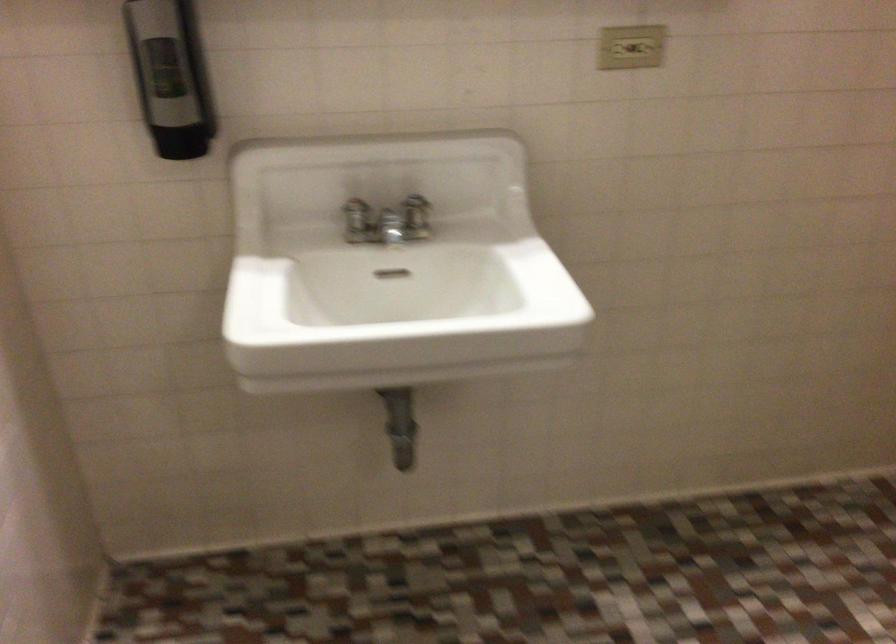
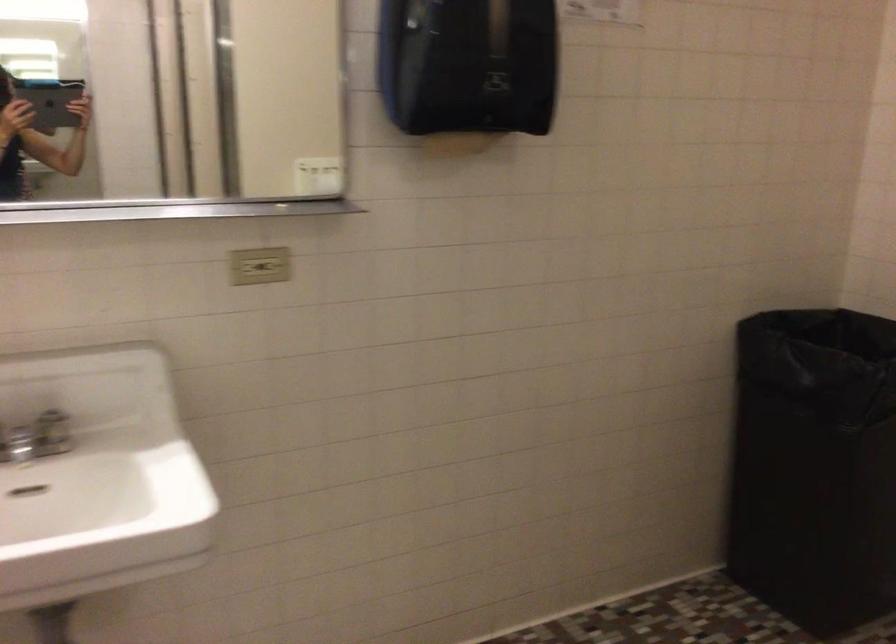
Where in the second image is the point corresponding to the point at 395,223 from the first image?

(37, 438)